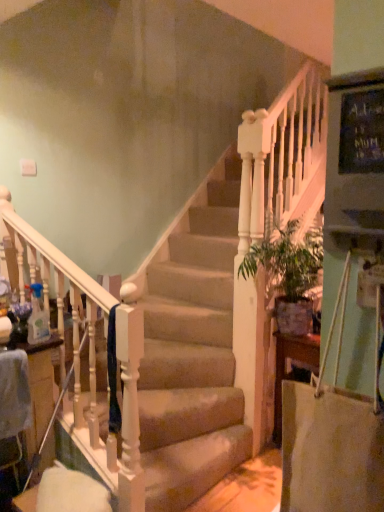
What do you see at coordinates (287, 262) in the screenshot? This screenshot has height=512, width=384. I see `green leafy plant at right` at bounding box center [287, 262].

At what (x,y) coordinates should I click in order to perform the action: click on green leafy plant at right. Please return your answer as a coordinate pair (x, y). The height and width of the screenshot is (512, 384). Looking at the image, I should click on (287, 262).

Find the location of `green leafy plant at right`. green leafy plant at right is located at coordinates (287, 262).